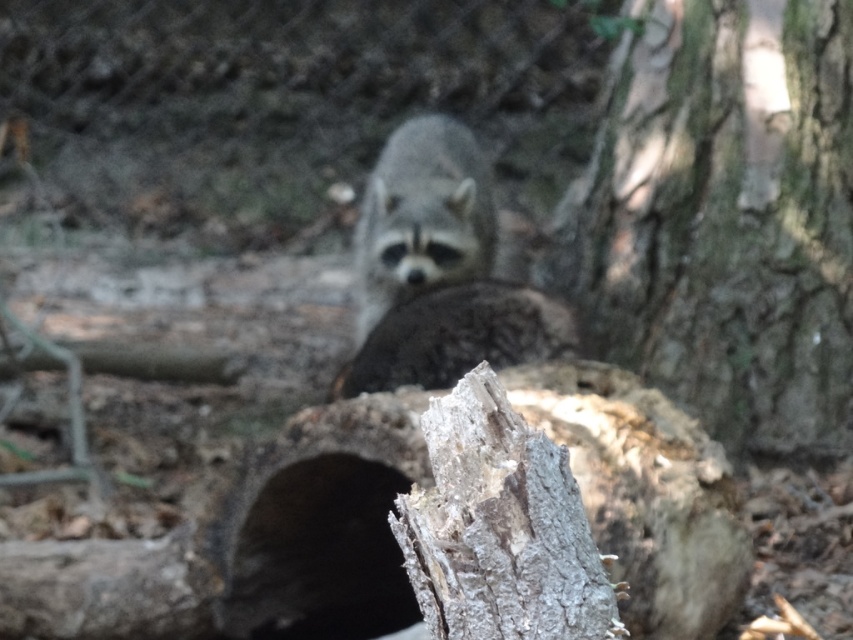
Is black matte hole at center to the left of fuzzy gray raccoon at center from the viewer's perspective?

Indeed, black matte hole at center is positioned on the left side of fuzzy gray raccoon at center.

How much distance is there between black matte hole at center and fuzzy gray raccoon at center?

black matte hole at center is 4.96 feet away from fuzzy gray raccoon at center.

The image size is (853, 640). What are the coordinates of `black matte hole at center` in the screenshot? It's located at (318, 554).

Does point (711, 68) come closer to viewer compared to point (477, 180)?

Yes, it is in front of point (477, 180).

Can you confirm if rough bark tree at center right is positioned to the right of fuzzy gray raccoon at center?

Indeed, rough bark tree at center right is positioned on the right side of fuzzy gray raccoon at center.

Who is more distant from viewer, (683, 237) or (427, 268)?

Point (427, 268)

You are a GUI agent. You are given a task and a screenshot of the screen. Output one action in this format:
    pyautogui.click(x=<x>, y=<y>)
    Task: Click on the rough bark tree at center right
    The height and width of the screenshot is (640, 853).
    Given the screenshot: What is the action you would take?
    pyautogui.click(x=721, y=225)

Is rough bark tree at center right smaller than black matte hole at center?

No, rough bark tree at center right is not smaller than black matte hole at center.

Between rough bark tree at center right and black matte hole at center, which one appears on the right side from the viewer's perspective?

Positioned to the right is rough bark tree at center right.

Who is more forward, (x=784, y=204) or (x=242, y=564)?

Point (x=242, y=564) is in front.

Where is `rough bark tree at center right`? The width and height of the screenshot is (853, 640). rough bark tree at center right is located at coordinates (721, 225).